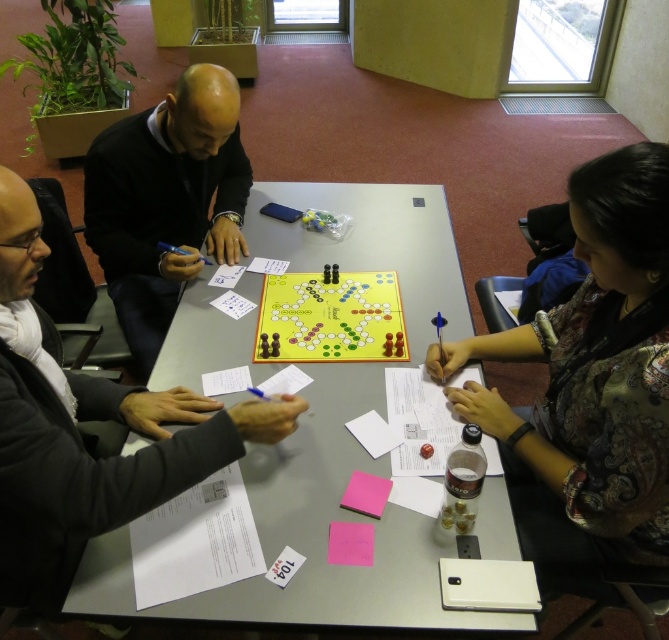
You are a participant in the scene and want to place a token on the yellow matte board game at center. However, there is a floral silk blouse at right in the way. Can you move the blouse to access the board game?

The floral silk blouse at right is below the yellow matte board game at center, so you cannot move the blouse to access the board game because it is already positioned underneath the board game.

You are organizing a small event and need to know which item takes up more space on the table. Which one is larger between the floral silk blouse at right and the black matte sweater at upper left?

The black matte sweater at upper left is larger because it occupies more space than the floral silk blouse at right.

You are a game designer observing the black matte sweater at upper left and the yellow matte board game at center. The minimum distance required between the board game and any personal items is 50 centimeters for safety. Is the current placement compliant with this rule?

The black matte sweater at upper left is 46.67 centimeters from the yellow matte board game at center, which is less than the required 50 centimeters. Therefore, the current placement does not comply with the safety rule.